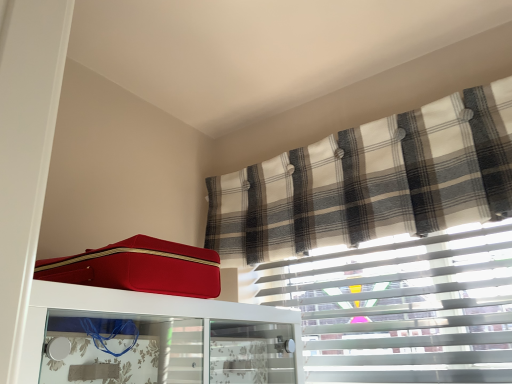
The height and width of the screenshot is (384, 512). Describe the element at coordinates (140, 268) in the screenshot. I see `matte red suitcase at upper left` at that location.

Locate an element on the screen. plaid fabric curtain at upper right is located at coordinates (372, 181).

Does plaid fabric curtain at upper right have a larger size compared to matte red suitcase at upper left?

No.

Locate an element on the screen. curtain lying above the matte red suitcase at upper left (from the image's perspective) is located at coordinates (372, 181).

From the image's perspective, between plaid fabric curtain at upper right and matte red suitcase at upper left, who is located below?

matte red suitcase at upper left.

Is plaid fabric curtain at upper right facing away from matte red suitcase at upper left?

That's not correct — plaid fabric curtain at upper right is not looking away from matte red suitcase at upper left.

From a real-world perspective, who is located higher, matte red suitcase at upper left or matte red suitcase at upper left?

matte red suitcase at upper left is physically above.

Is matte red suitcase at upper left at the back of matte red suitcase at upper left?

That's not correct — matte red suitcase at upper left is not looking away from matte red suitcase at upper left.

Considering the relative sizes of matte red suitcase at upper left and matte red suitcase at upper left in the image provided, is matte red suitcase at upper left shorter than matte red suitcase at upper left?

Yes.

Measure the distance between matte red suitcase at upper left and matte red suitcase at upper left.

matte red suitcase at upper left and matte red suitcase at upper left are 3.21 inches apart from each other.

Considering the sizes of objects matte red suitcase at upper left and matte red suitcase at upper left in the image provided, who is wider, matte red suitcase at upper left or matte red suitcase at upper left?

With larger width is matte red suitcase at upper left.

Is point (40, 341) farther from viewer compared to point (143, 274)?

No, it is in front of (143, 274).

Is matte red suitcase at upper left positioned far away from matte red suitcase at upper left?

No, matte red suitcase at upper left is not far away from matte red suitcase at upper left.

From a real-world perspective, does matte red suitcase at upper left sit lower than plaid fabric curtain at upper right?

Yes.

From the image's perspective, is matte red suitcase at upper left located beneath plaid fabric curtain at upper right?

Correct, matte red suitcase at upper left appears lower than plaid fabric curtain at upper right in the image.

Is plaid fabric curtain at upper right located within matte red suitcase at upper left?

No, matte red suitcase at upper left does not contain plaid fabric curtain at upper right.

Is matte red suitcase at upper left to the right of plaid fabric curtain at upper right from the viewer's perspective?

No, matte red suitcase at upper left is not to the right of plaid fabric curtain at upper right.

The image size is (512, 384). In the image, there is a plaid fabric curtain at upper right. In order to click on furniture below it (from the image's perspective) in this screenshot , I will do `click(136, 313)`.

Does point (30, 361) lie behind point (320, 207)?

No, (30, 361) is closer to viewer.

Considering the sizes of objects plaid fabric curtain at upper right and matte red suitcase at upper left in the image provided, who is bigger, plaid fabric curtain at upper right or matte red suitcase at upper left?

With larger size is plaid fabric curtain at upper right.

Is plaid fabric curtain at upper right not near matte red suitcase at upper left?

They are positioned close to each other.

Is plaid fabric curtain at upper right to the right of matte red suitcase at upper left from the viewer's perspective?

Yes.

Is matte red suitcase at upper left at the back of plaid fabric curtain at upper right?

No, matte red suitcase at upper left is not at the back of plaid fabric curtain at upper right.

The image size is (512, 384). In order to click on curtain that is on the right side of matte red suitcase at upper left in this screenshot , I will do `click(372, 181)`.

This screenshot has width=512, height=384. What are the coordinates of `suitcase above the matte red suitcase at upper left (from the image's perspective)` in the screenshot? It's located at (140, 268).

Based on their spatial positions, is plaid fabric curtain at upper right or matte red suitcase at upper left further from matte red suitcase at upper left?

plaid fabric curtain at upper right is further to matte red suitcase at upper left.

Which object lies nearer to the anchor point plaid fabric curtain at upper right, matte red suitcase at upper left or matte red suitcase at upper left?

Among the two, matte red suitcase at upper left is located nearer to plaid fabric curtain at upper right.

When comparing their distances from matte red suitcase at upper left, does matte red suitcase at upper left or plaid fabric curtain at upper right seem closer?

matte red suitcase at upper left is closer to matte red suitcase at upper left.

Looking at the image, which one is located closer to matte red suitcase at upper left, plaid fabric curtain at upper right or matte red suitcase at upper left?

matte red suitcase at upper left is positioned closer to the anchor matte red suitcase at upper left.

When comparing their distances from matte red suitcase at upper left, does matte red suitcase at upper left or plaid fabric curtain at upper right seem further?

plaid fabric curtain at upper right is positioned further to the anchor matte red suitcase at upper left.

In the scene shown: Which object lies nearer to the anchor point plaid fabric curtain at upper right, matte red suitcase at upper left or matte red suitcase at upper left?

matte red suitcase at upper left.

Locate an element on the screen. suitcase situated between matte red suitcase at upper left and plaid fabric curtain at upper right from left to right is located at coordinates (140, 268).